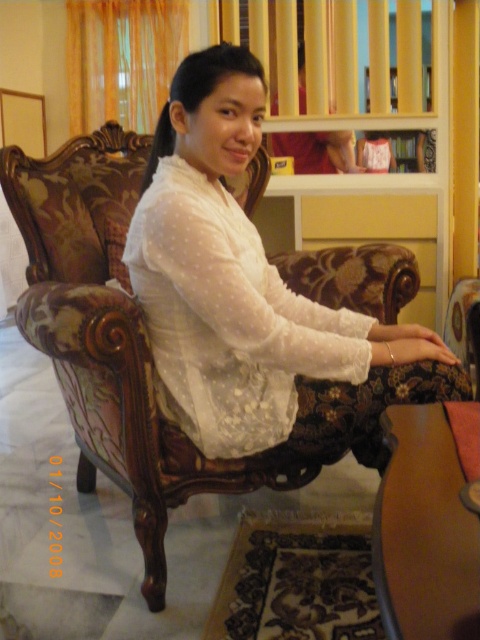
Consider the image. Which of these two, white sheer blouse at center or wooden bookshelf at upper center, stands shorter?

With less height is wooden bookshelf at upper center.

Can you confirm if white sheer blouse at center is positioned to the left of wooden bookshelf at upper center?

Correct, you'll find white sheer blouse at center to the left of wooden bookshelf at upper center.

Measure the distance between white sheer blouse at center and camera.

white sheer blouse at center and camera are 1.21 meters apart from each other.

This screenshot has width=480, height=640. What are the coordinates of `white sheer blouse at center` in the screenshot? It's located at (251, 291).

Does point (394, 92) come in front of point (360, 157)?

Yes, it is.

Is wooden bookshelf at upper center positioned before white sheer dress at center?

Yes, it is in front of white sheer dress at center.

Between point (364, 77) and point (389, 156), which one is positioned behind?

Positioned behind is point (389, 156).

The width and height of the screenshot is (480, 640). In order to click on wooden bookshelf at upper center in this screenshot , I will do `click(409, 148)`.

Between point (215, 262) and point (388, 154), which one is positioned in front?

Positioned in front is point (215, 262).

Is point (190, 106) closer to camera compared to point (372, 156)?

Yes.

This screenshot has height=640, width=480. I want to click on white sheer blouse at center, so pyautogui.click(x=251, y=291).